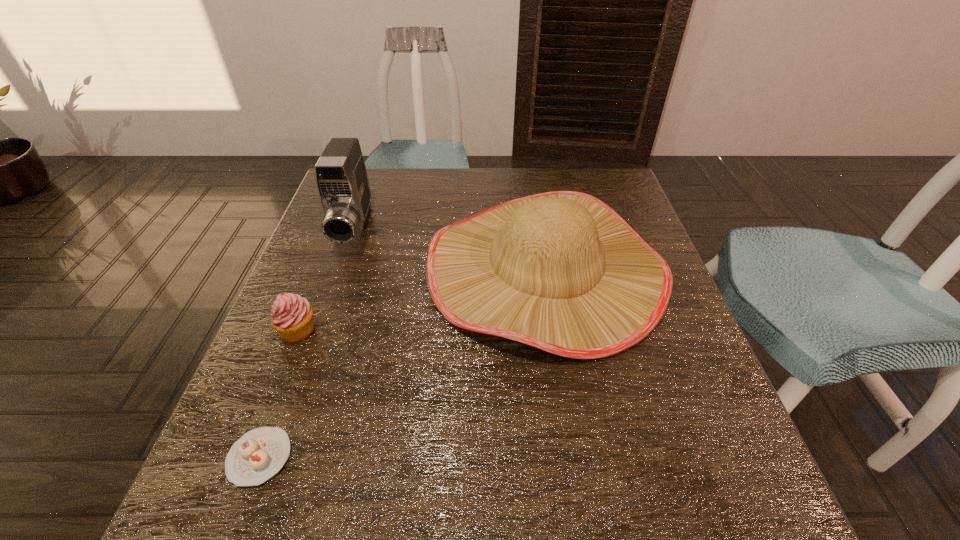
The height and width of the screenshot is (540, 960). I want to click on free point between the taller cupcake and the shorter cupcake, so click(x=279, y=394).

Image resolution: width=960 pixels, height=540 pixels. In order to click on free area in between the camcorder and the farther cupcake in this screenshot , I will do `click(325, 279)`.

The image size is (960, 540). I want to click on the third closest object to the sunhat, so click(259, 454).

Select which object appears as the third closest to the camcorder. Please provide its 2D coordinates. Your answer should be formatted as a tuple, i.e. [(x, y)], where the tuple contains the x and y coordinates of a point satisfying the conditions above.

[(259, 454)]

In order to click on free space that satisfies the following two spatial constraints: 1. on the back side of the farther cupcake; 2. on the right side of the sunhat in this screenshot , I will do `click(322, 269)`.

Image resolution: width=960 pixels, height=540 pixels. In order to click on free space that satisfies the following two spatial constraints: 1. at the front of the sunhat, highlighting the lens; 2. on the left side of the camcorder in this screenshot , I will do `click(339, 269)`.